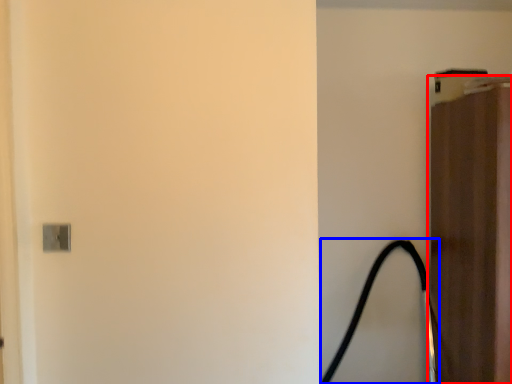
Question: Which object is closer to the camera taking this photo, door (highlighted by a red box) or garden hose (highlighted by a blue box)?

Choices:
 (A) door
 (B) garden hose

Answer: (A)